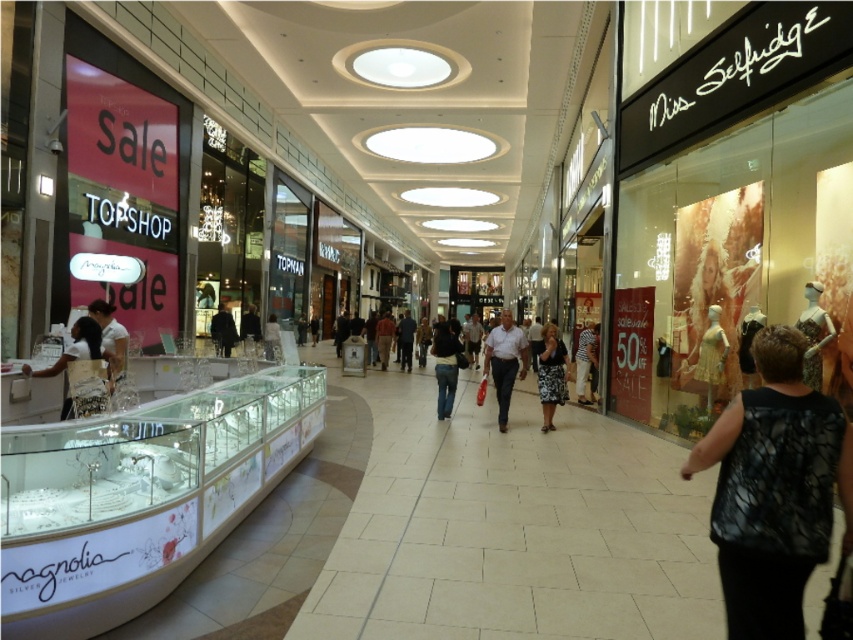
In the scene shown: Can you confirm if black floral dress at center is shorter than dark blue jeans at center?

Incorrect, black floral dress at center's height does not fall short of dark blue jeans at center's.

Is black floral dress at center bigger than dark blue jeans at center?

Yes, black floral dress at center is bigger than dark blue jeans at center.

Where is `black floral dress at center`? This screenshot has height=640, width=853. black floral dress at center is located at coordinates (550, 374).

This screenshot has height=640, width=853. Find the location of `dark blue jeans at center`. dark blue jeans at center is located at coordinates (445, 364).

Between point (445, 353) and point (253, 316), which one is positioned behind?

Point (253, 316)

Where is `dark blue jeans at center`? This screenshot has height=640, width=853. dark blue jeans at center is located at coordinates (445, 364).

Locate an element on the screen. Image resolution: width=853 pixels, height=640 pixels. dark blue jeans at center is located at coordinates (445, 364).

The width and height of the screenshot is (853, 640). Find the location of `white fabric bag at lower left`. white fabric bag at lower left is located at coordinates (79, 349).

Does point (90, 349) come closer to viewer compared to point (434, 333)?

Yes, it is.

At what (x,y) coordinates should I click in order to perform the action: click on white fabric bag at lower left. Please return your answer as a coordinate pair (x, y). This screenshot has width=853, height=640. Looking at the image, I should click on (79, 349).